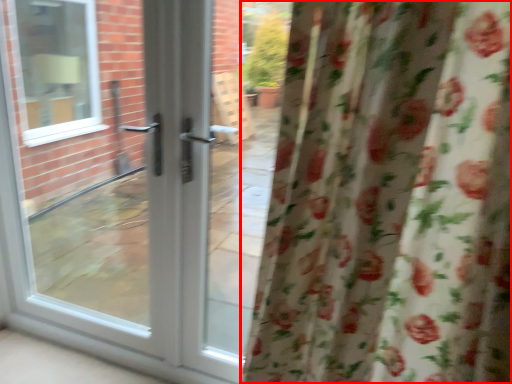
Question: From the image's perspective, where is curtain (annotated by the red box) located in relation to door in the image?

Choices:
 (A) above
 (B) below

Answer: (B)